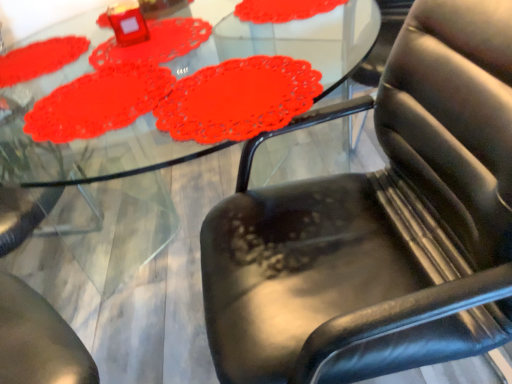
Question: Is matte red doily at upper left, which is the 1th mat from back to front, wider than matte red doily at upper left, placed as the 1th mat when sorted from front to back?

Choices:
 (A) yes
 (B) no

Answer: (B)

Question: Does matte red doily at upper left, which is the 3th mat from front to back, have a larger size compared to matte red doily at upper left, placed as the 1th mat when sorted from front to back?

Choices:
 (A) yes
 (B) no

Answer: (B)

Question: From a real-world perspective, is matte red doily at upper left, which is the 1th mat from back to front, positioned over matte red doily at upper left, the third mat from the back, based on gravity?

Choices:
 (A) yes
 (B) no

Answer: (A)

Question: Is matte red doily at upper left, which is the 1th mat from back to front, to the left of matte red doily at upper left, the third mat from the back, from the viewer's perspective?

Choices:
 (A) no
 (B) yes

Answer: (B)

Question: Is matte red doily at upper left, which is the 3th mat from front to back, facing away from matte red doily at upper left, the third mat from the back?

Choices:
 (A) yes
 (B) no

Answer: (B)

Question: Is matte red doily at upper left, the third mat from the back, inside matte red doily at upper left, which is the 3th mat from front to back?

Choices:
 (A) no
 (B) yes

Answer: (A)

Question: Would you say black leather chair at lower right is a long distance from matte red doily at upper left, the third mat from the back?

Choices:
 (A) no
 (B) yes

Answer: (A)

Question: Does black leather chair at lower right appear on the right side of matte red doily at upper left, placed as the 1th mat when sorted from front to back?

Choices:
 (A) no
 (B) yes

Answer: (B)

Question: From the image's perspective, does black leather chair at lower right appear lower than matte red doily at upper left, placed as the 1th mat when sorted from front to back?

Choices:
 (A) no
 (B) yes

Answer: (B)

Question: Would you say black leather chair at lower right contains matte red doily at upper left, the third mat from the back?

Choices:
 (A) yes
 (B) no

Answer: (B)

Question: Is black leather chair at lower right facing away from matte red doily at upper left, placed as the 1th mat when sorted from front to back?

Choices:
 (A) yes
 (B) no

Answer: (B)

Question: Considering the relative sizes of black leather chair at lower right and matte red doily at upper left, the third mat from the back, in the image provided, is black leather chair at lower right shorter than matte red doily at upper left, the third mat from the back,?

Choices:
 (A) no
 (B) yes

Answer: (A)

Question: Considering the relative sizes of matte red doily at upper left, the third mat from the back, and matte red doily at upper center, which is the second mat from front to back, in the image provided, is matte red doily at upper left, the third mat from the back, thinner than matte red doily at upper center, which is the second mat from front to back,?

Choices:
 (A) yes
 (B) no

Answer: (B)